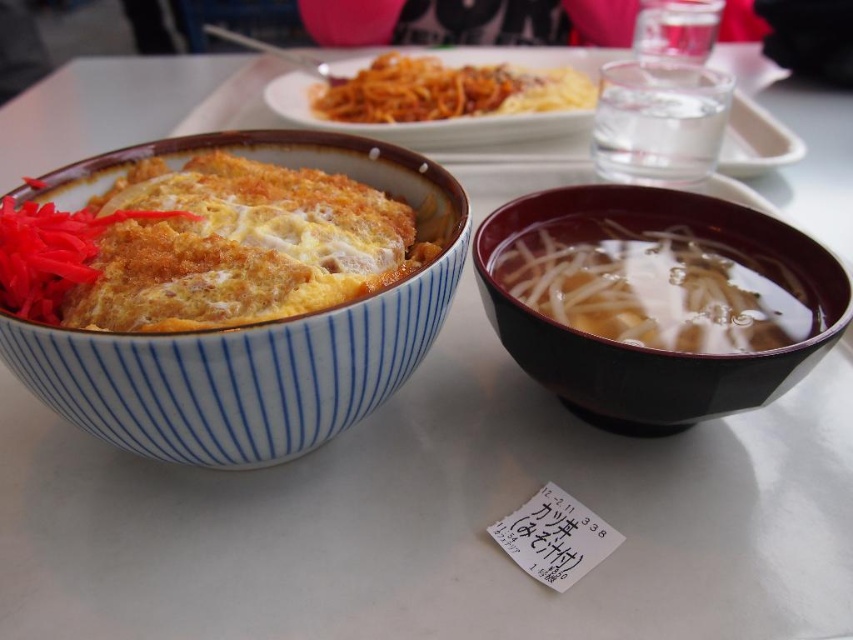
Question: Is the position of black glossy bowl at right more distant than that of smooth tomato sauce pasta at upper center?

Choices:
 (A) no
 (B) yes

Answer: (A)

Question: Does black glossy bowl at right come in front of blue striped bowl at left?

Choices:
 (A) no
 (B) yes

Answer: (A)

Question: Which of these objects is positioned closest to the blue striped bowl at left?

Choices:
 (A) black glossy bowl at right
 (B) translucent broth at right
 (C) smooth tomato sauce pasta at upper center

Answer: (A)

Question: Which of the following is the farthest from the observer?

Choices:
 (A) translucent broth at right
 (B) blue striped bowl at left
 (C) black glossy bowl at right

Answer: (A)

Question: Is black glossy bowl at right above translucent broth at right?

Choices:
 (A) yes
 (B) no

Answer: (B)

Question: Which point is closer to the camera?

Choices:
 (A) (532, 307)
 (B) (144, 445)

Answer: (B)